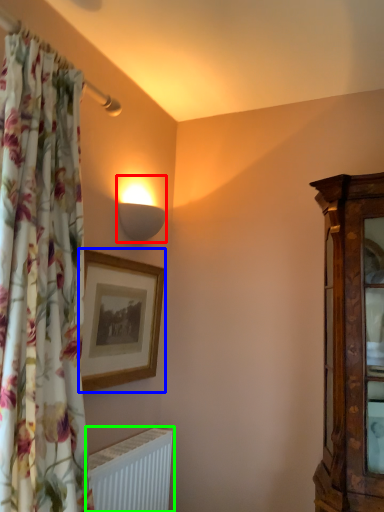
Question: Estimate the real-world distances between objects in this image. Which object is farther from lamp (highlighted by a red box), picture frame (highlighted by a blue box) or radiator (highlighted by a green box)?

Choices:
 (A) picture frame
 (B) radiator

Answer: (B)